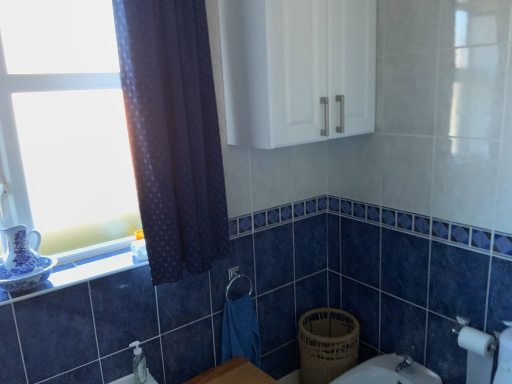
Locate an element on the screen. The image size is (512, 384). vacant area located to the right-hand side of blue porcelain tea pot at left is located at coordinates (93, 265).